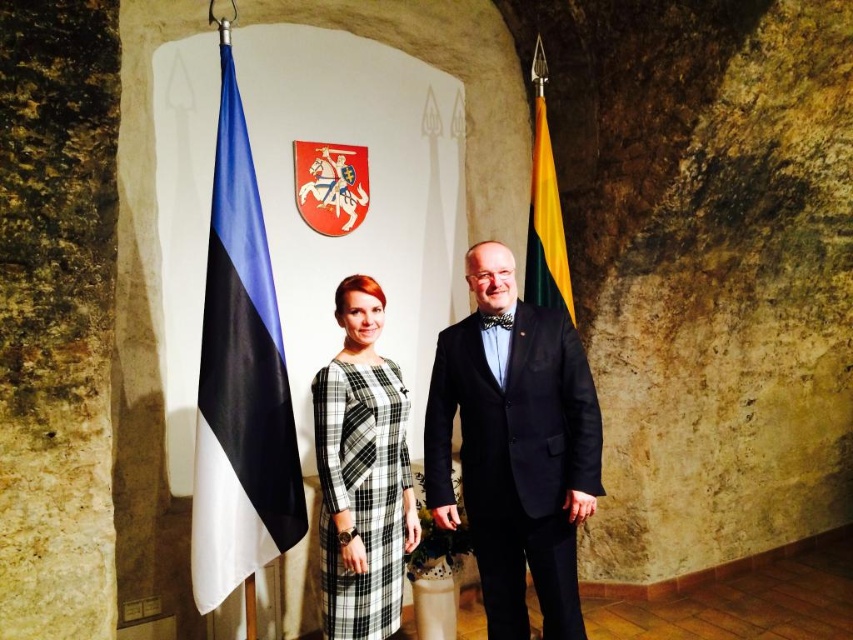
Question: Which point appears farthest from the camera in this image?

Choices:
 (A) (538, 204)
 (B) (305, 502)
 (C) (387, 380)

Answer: (A)

Question: Can you confirm if blue/white fabric flag at left is bigger than yellow-green fabric flag at right?

Choices:
 (A) no
 (B) yes

Answer: (B)

Question: Is black checkered dress at center in front of yellow-green fabric flag at right?

Choices:
 (A) yes
 (B) no

Answer: (A)

Question: Where is blue/white fabric flag at left located in relation to black checkered dress at center in the image?

Choices:
 (A) above
 (B) below

Answer: (A)

Question: Which object appears closest to the camera in this image?

Choices:
 (A) black satin suit at center
 (B) blue/white fabric flag at left

Answer: (B)

Question: Which object is positioned farthest from the blue/white fabric flag at left?

Choices:
 (A) black satin suit at center
 (B) yellow-green fabric flag at right
 (C) black checkered dress at center

Answer: (B)